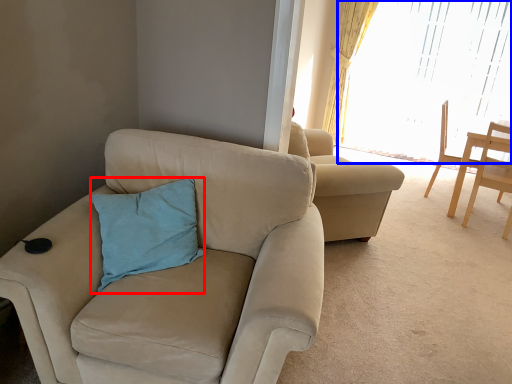
Question: Among these objects, which one is farthest to the camera, pillow (highlighted by a red box) or window (highlighted by a blue box)?

Choices:
 (A) pillow
 (B) window

Answer: (B)